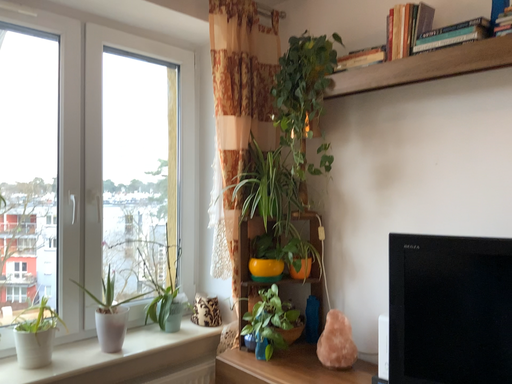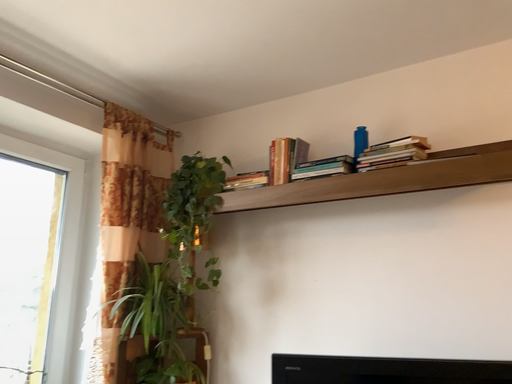
Question: Which way did the camera rotate in the video?

Choices:
 (A) rotated downward
 (B) rotated upward

Answer: (B)